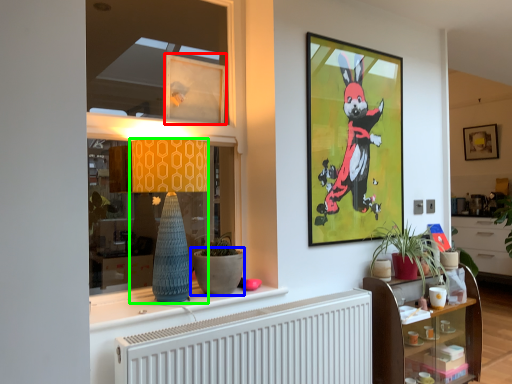
Question: Which object is the closest to the picture frame (highlighted by a red box)? Choose among these: flowerpot (highlighted by a blue box) or lamp (highlighted by a green box).

Choices:
 (A) flowerpot
 (B) lamp

Answer: (B)